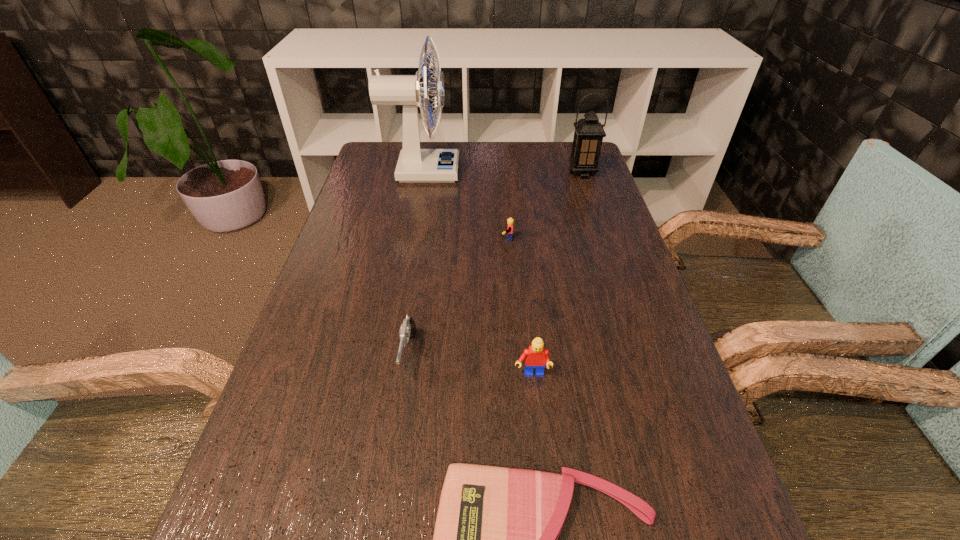
Identify which object is the fourth nearest to the gun. Please provide its 2D coordinates. Your answer should be formatted as a tuple, i.e. [(x, y)], where the tuple contains the x and y coordinates of a point satisfying the conditions above.

[(415, 164)]

This screenshot has width=960, height=540. I want to click on vacant position in the image that satisfies the following two spatial constraints: 1. on the front-facing side of the tallest object; 2. on the back side of the rightmost object, so click(421, 173).